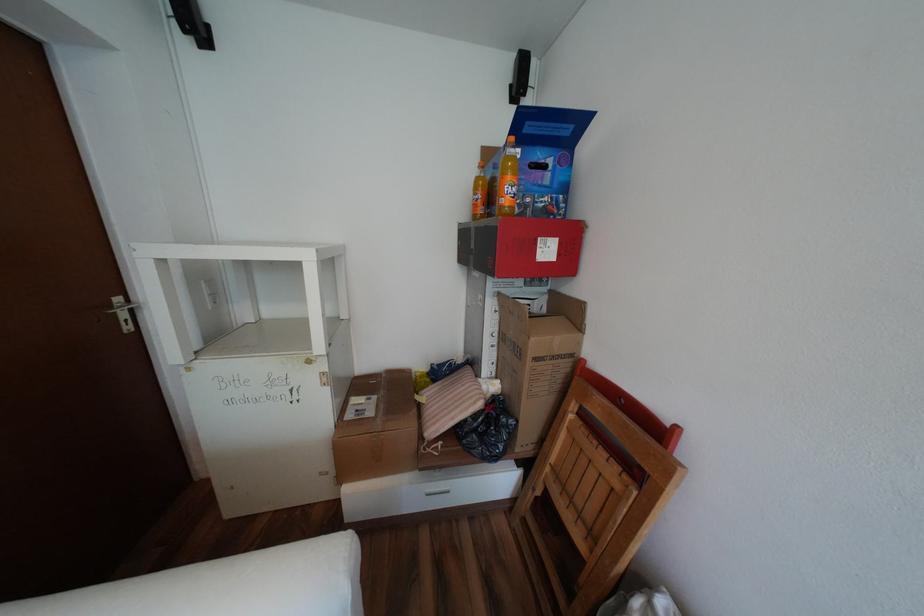
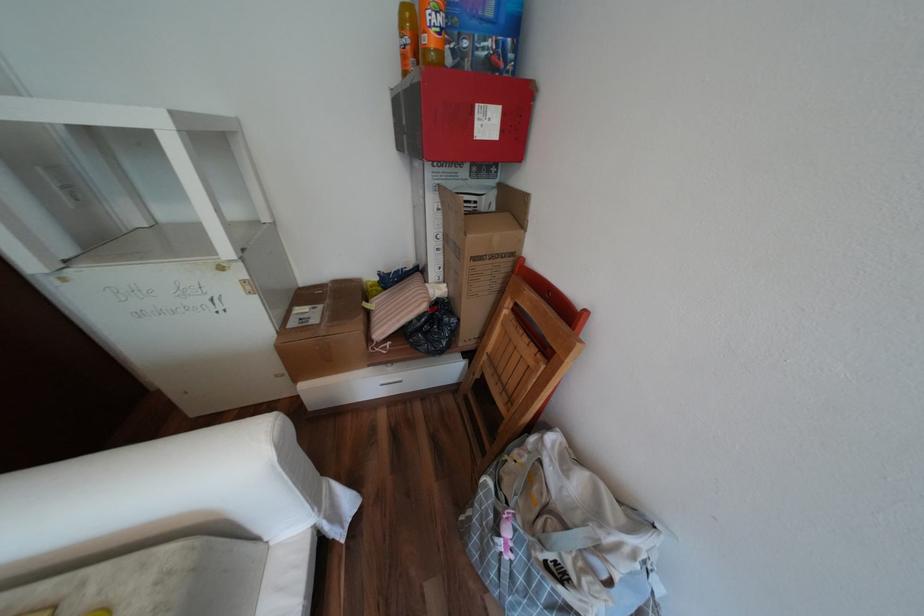
Question: How did the camera likely rotate?

Choices:
 (A) Left
 (B) Right
 (C) Up
 (D) Down

Answer: (D)